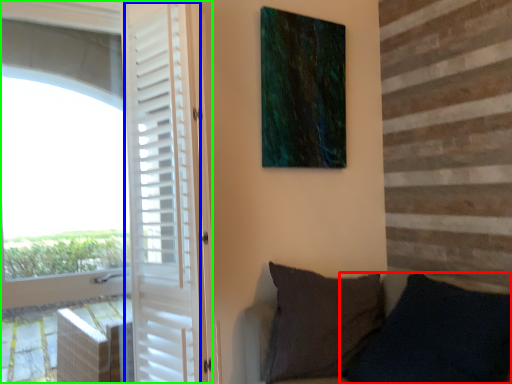
Question: Based on their relative distances, which object is nearer to pillow (highlighted by a red box)? Choose from screen door (highlighted by a blue box) and door (highlighted by a green box).

Choices:
 (A) screen door
 (B) door

Answer: (A)